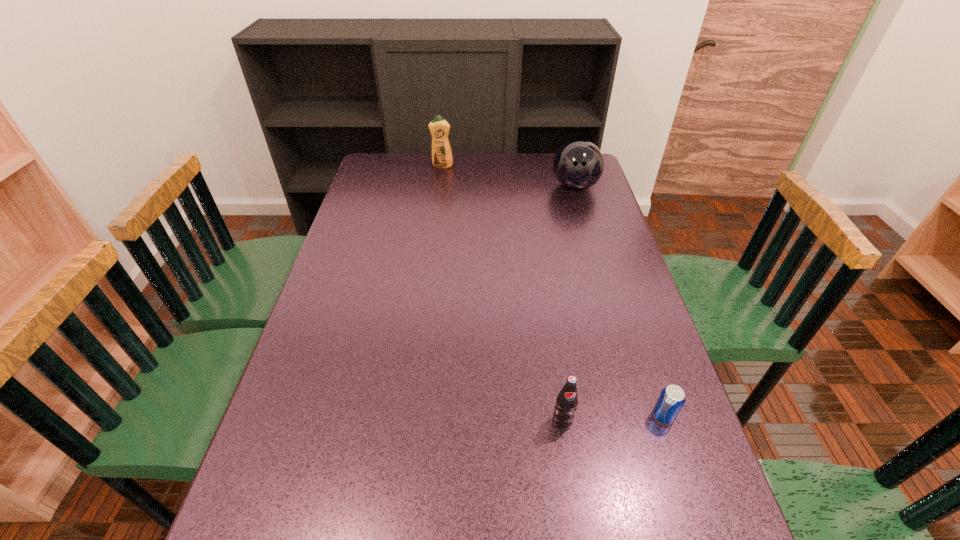
This screenshot has width=960, height=540. In order to click on unoccupied position between the second shortest object and the bowling ball in this screenshot , I will do `click(568, 304)`.

The height and width of the screenshot is (540, 960). I want to click on empty location between the bowling ball and the leftmost object, so click(x=509, y=177).

Locate an element on the screen. vacant area that lies between the beer can and the bowling ball is located at coordinates (619, 302).

The height and width of the screenshot is (540, 960). In order to click on vacant space that's between the leftmost object and the third object from right to left in this screenshot , I will do point(502,294).

Image resolution: width=960 pixels, height=540 pixels. I want to click on free space between the leftmost object and the pop, so click(x=502, y=294).

The height and width of the screenshot is (540, 960). I want to click on vacant space that's between the third nearest object and the third object from right to left, so click(568, 304).

Identify the location of free spot between the third object from right to left and the detergent. This screenshot has height=540, width=960. (502, 294).

What are the coordinates of `vacant area that lies between the bowling ball and the shortest object` in the screenshot? It's located at (619, 302).

What are the coordinates of `free space between the second shortest object and the detergent` in the screenshot? It's located at (502, 294).

The height and width of the screenshot is (540, 960). I want to click on object that is the third nearest to the detergent, so click(x=672, y=398).